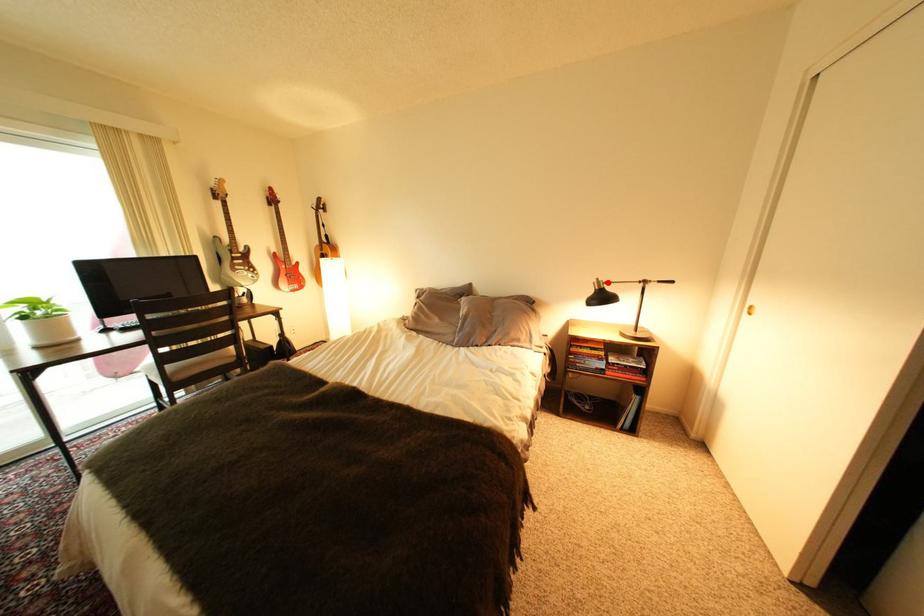
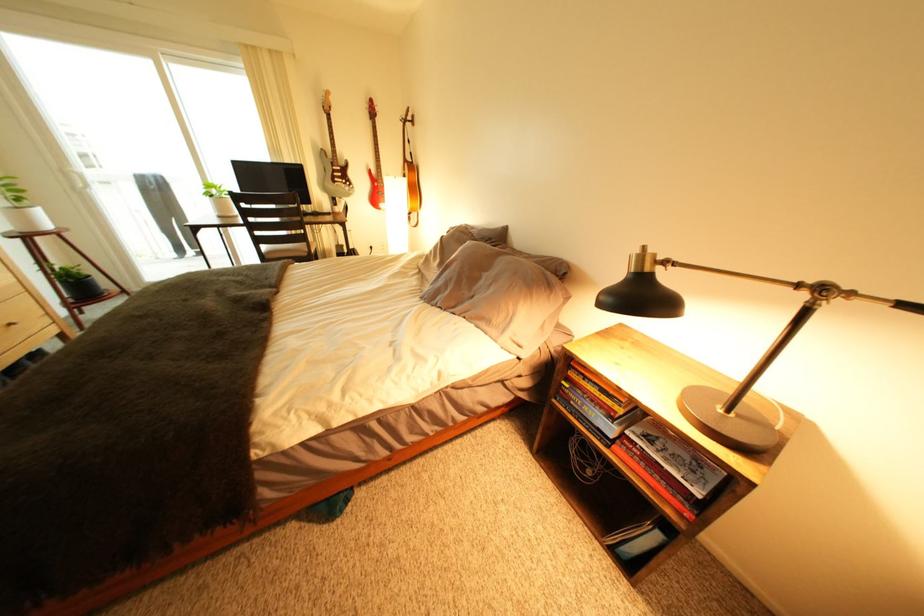
Where in the second image is the point corresponding to the highlighted location from the first image?

(650, 253)